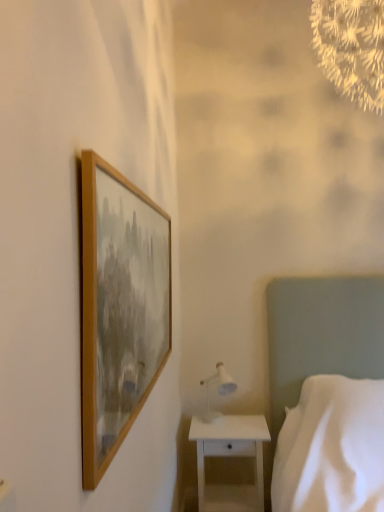
Question: From their relative heights in the image, would you say wooden frame at upper left is taller or shorter than white glossy nightstand at lower right?

Choices:
 (A) tall
 (B) short

Answer: (A)

Question: Would you say wooden frame at upper left is inside or outside white glossy nightstand at lower right?

Choices:
 (A) outside
 (B) inside

Answer: (A)

Question: Which object is the farthest from the white fabric bed at right?

Choices:
 (A) wooden frame at upper left
 (B) white glossy table lamp at lower right
 (C) white glossy nightstand at lower right

Answer: (A)

Question: Which object is positioned farthest from the white glossy table lamp at lower right?

Choices:
 (A) white fabric bed at right
 (B) white glossy nightstand at lower right
 (C) wooden frame at upper left

Answer: (C)